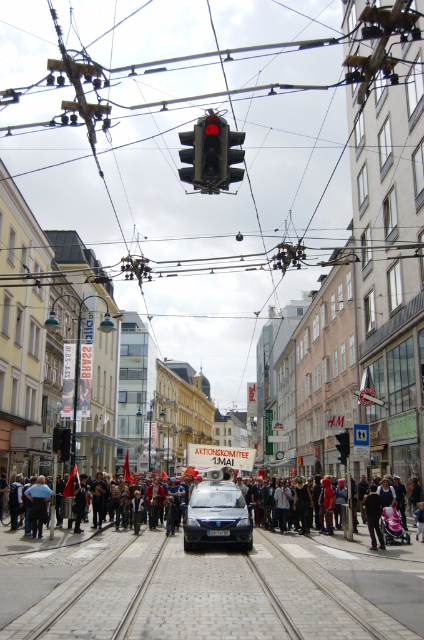
You are a pedestrian standing on the street and see the black glass traffic light at upper center and the dark blue jeans at center. Which object is taller?

The black glass traffic light at upper center is taller than the dark blue jeans at center.

You are a photographer trying to capture the black fabric crowd at center and the dark blue jeans at center in a single frame. Which of the two objects should you adjust your camera angle to include first, considering their sizes?

The black fabric crowd at center is wider than the dark blue jeans at center, so you should adjust your camera angle to include the black fabric crowd at center first.